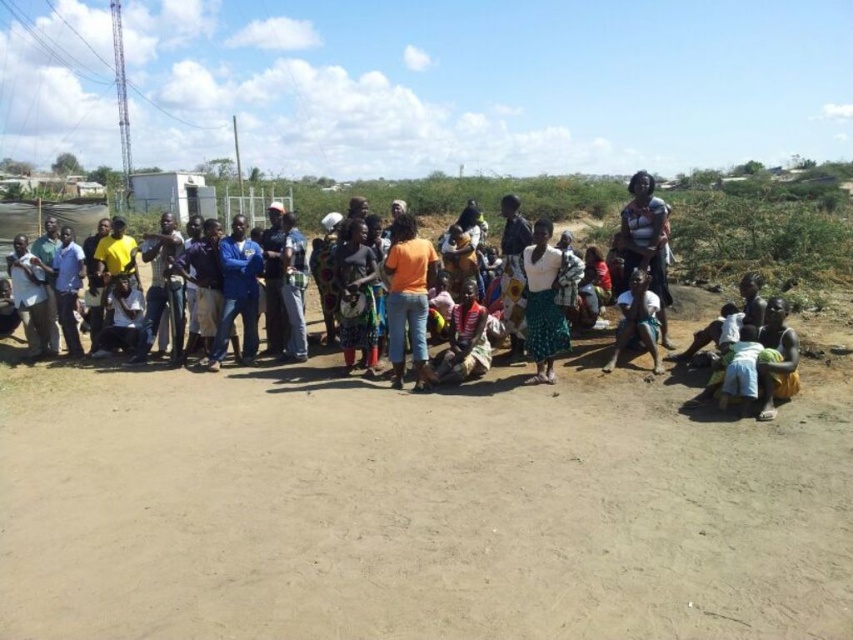
In the scene shown: Does brown sandy ground at center have a lesser width compared to white fabric skirt at center?

Incorrect, brown sandy ground at center's width is not less than white fabric skirt at center's.

Is brown sandy ground at center taller than white fabric skirt at center?

Incorrect, brown sandy ground at center's height is not larger of white fabric skirt at center's.

Is point (828, 440) more distant than point (527, 300)?

No, (828, 440) is in front of (527, 300).

Where is `brown sandy ground at center`? This screenshot has width=853, height=640. brown sandy ground at center is located at coordinates click(418, 509).

Is point (494, 413) closer to viewer compared to point (599, 352)?

Yes.

Who is positioned more to the left, brown sandy ground at center or orange cotton shirt at center?

Positioned to the left is brown sandy ground at center.

Is point (318, 545) positioned in front of point (780, 337)?

Yes, it is in front of point (780, 337).

Where is `brown sandy ground at center`? Image resolution: width=853 pixels, height=640 pixels. brown sandy ground at center is located at coordinates (418, 509).

From the picture: Is orange matte shirt at center closer to camera compared to white fabric skirt at center?

No, orange matte shirt at center is behind white fabric skirt at center.

Is orange matte shirt at center to the right of white fabric skirt at center from the viewer's perspective?

In fact, orange matte shirt at center is to the left of white fabric skirt at center.

Between point (430, 282) and point (546, 340), which one is positioned in front?

Point (546, 340) is more forward.

This screenshot has height=640, width=853. I want to click on orange matte shirt at center, so pyautogui.click(x=407, y=298).